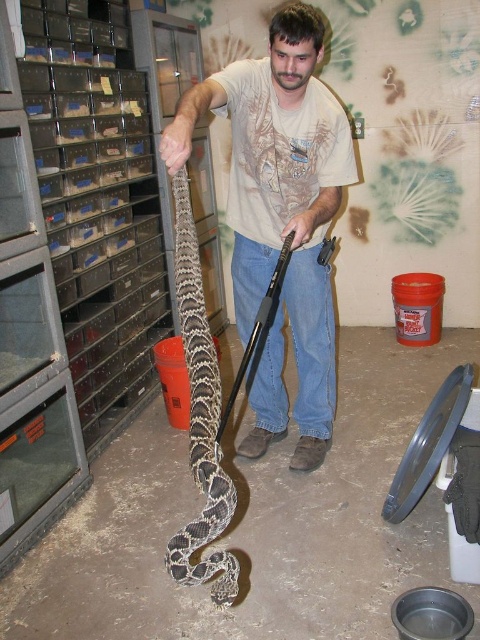
Question: Which of the following is the closest to the observer?

Choices:
 (A) (191, 321)
 (B) (251, 150)

Answer: (A)

Question: Does light brown cotton t-shirt at center have a larger size compared to patterned scales snake at center?

Choices:
 (A) yes
 (B) no

Answer: (A)

Question: Does light brown cotton t-shirt at center have a larger size compared to patterned scales snake at center?

Choices:
 (A) no
 (B) yes

Answer: (B)

Question: Which point is closer to the camera?

Choices:
 (A) light brown cotton t-shirt at center
 (B) patterned scales snake at center

Answer: (B)

Question: Considering the relative positions of light brown cotton t-shirt at center and patterned scales snake at center in the image provided, where is light brown cotton t-shirt at center located with respect to patterned scales snake at center?

Choices:
 (A) below
 (B) above

Answer: (B)

Question: Which point is farther from the camera taking this photo?

Choices:
 (A) (211, 368)
 (B) (287, 12)

Answer: (B)